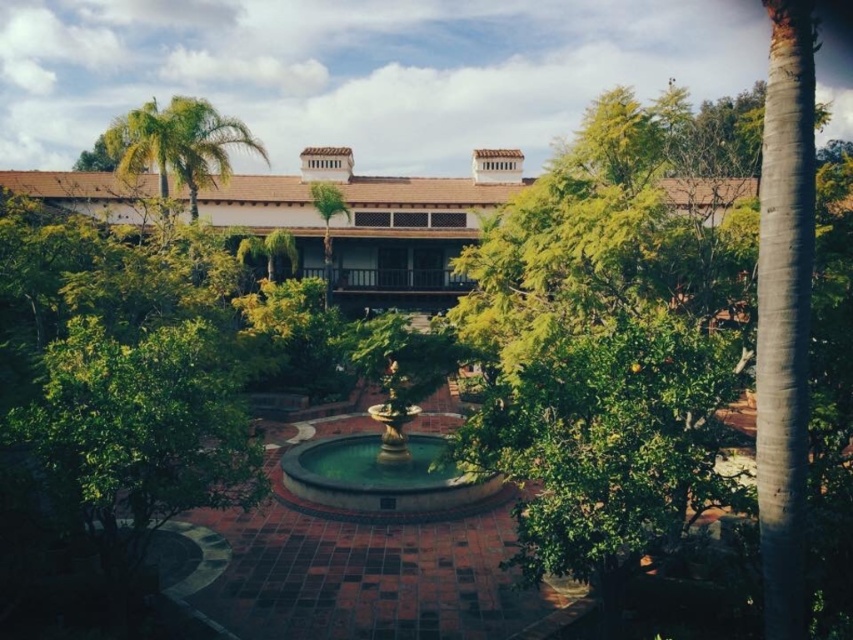
Does gold metallic fountain at center have a smaller size compared to green leafy palm tree at upper left?

Yes.

Which is behind, point (334, 461) or point (113, 157)?

The point (113, 157) is behind.

Locate an element on the screen. gold metallic fountain at center is located at coordinates (380, 474).

Who is more forward, (505, 157) or (374, 410)?

Point (374, 410)

Where is `brown tile roof at upper center`? brown tile roof at upper center is located at coordinates (373, 221).

Who is more forward, (242, 221) or (149, 128)?

Positioned in front is point (149, 128).

What do you see at coordinates (373, 221) in the screenshot? The width and height of the screenshot is (853, 640). I see `brown tile roof at upper center` at bounding box center [373, 221].

The image size is (853, 640). Identify the location of brown tile roof at upper center. (373, 221).